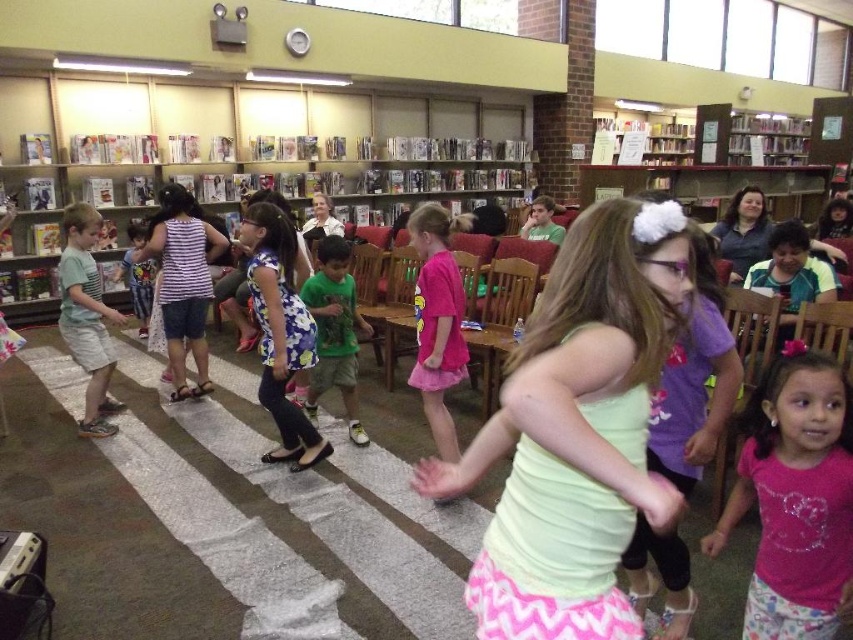
Question: Does matte green shirt at left have a lesser width compared to purple cotton shirt at center?

Choices:
 (A) yes
 (B) no

Answer: (A)

Question: Which of these objects is positioned closest to the wooden chair at right?

Choices:
 (A) green matte shirt at center
 (B) purple cotton shirt at center
 (C) wooden bookshelf at center
 (D) matte green shirt at left

Answer: (B)

Question: Which of the following is the farthest from the observer?

Choices:
 (A) wooden bookshelf at center
 (B) purple cotton shirt at center

Answer: (A)

Question: Does matte green shirt at left appear on the right side of green matte shirt at center?

Choices:
 (A) yes
 (B) no

Answer: (B)

Question: Which point is closer to the camera?

Choices:
 (A) wooden chair at right
 (B) matte green shirt at left
 (C) green matte shirt at center
 (D) striped fabric shirt at center

Answer: (A)

Question: Considering the relative positions of wooden bookshelf at center and purple cotton shirt at center in the image provided, where is wooden bookshelf at center located with respect to purple cotton shirt at center?

Choices:
 (A) below
 (B) above

Answer: (B)